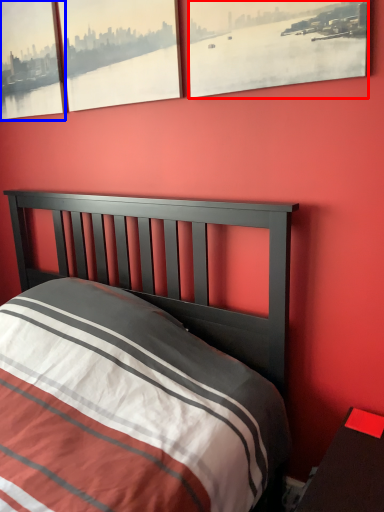
Question: Which object appears farthest to the camera in this image, window (highlighted by a red box) or window (highlighted by a blue box)?

Choices:
 (A) window
 (B) window

Answer: (B)